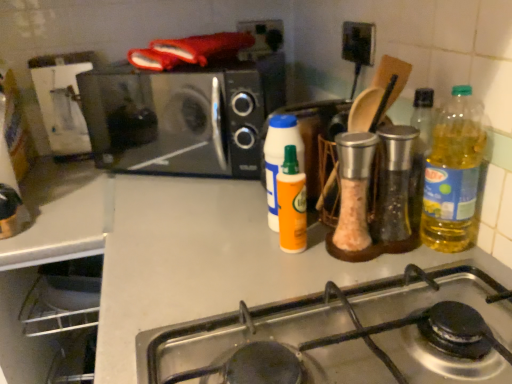
The image size is (512, 384). Identify the location of vacant area situated to the left side of yellow translucent bottle at right, the 1th bottle from the right. (339, 265).